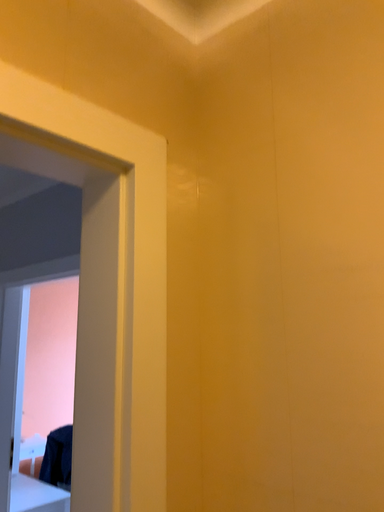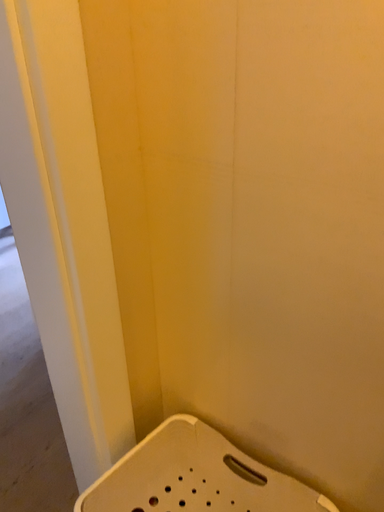
Question: How did the camera likely rotate when shooting the video?

Choices:
 (A) rotated downward
 (B) rotated upward

Answer: (A)